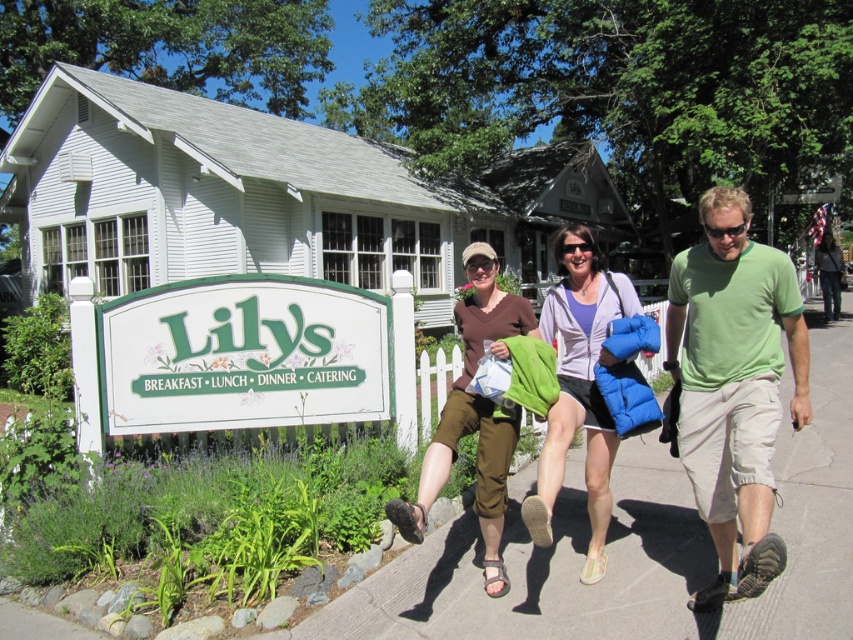
Question: Does green cotton shorts at center have a lesser width compared to green cotton t-shirt at center?

Choices:
 (A) yes
 (B) no

Answer: (B)

Question: Does light purple fleece jacket at center appear over brown cotton shirt at center?

Choices:
 (A) yes
 (B) no

Answer: (A)

Question: Which point appears farthest from the camera in this image?

Choices:
 (A) (720, 292)
 (B) (833, 264)
 (C) (585, 228)
 (D) (791, 336)

Answer: (B)

Question: Which object appears farthest from the camera in this image?

Choices:
 (A) brown cotton shirt at center
 (B) green cotton shorts at center
 (C) light purple fleece jacket at center
 (D) green cotton t-shirt at center

Answer: (A)

Question: Can you confirm if green cotton shorts at center is positioned to the left of light purple fleece jacket at center?

Choices:
 (A) yes
 (B) no

Answer: (B)

Question: Which object is the farthest from the light purple fleece jacket at center?

Choices:
 (A) brown cotton shirt at center
 (B) denim jacket at center
 (C) green cotton t-shirt at center
 (D) green cotton shorts at center

Answer: (B)